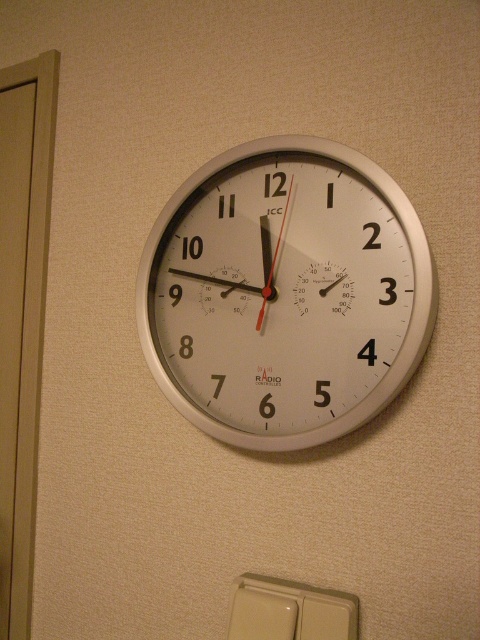
Question: Which object appears closest to the camera in this image?

Choices:
 (A) white metallic clock at center
 (B) beige plastic light switch at lower center

Answer: (A)

Question: Is white metallic clock at center smaller than beige plastic light switch at lower center?

Choices:
 (A) no
 (B) yes

Answer: (A)

Question: Can you confirm if white metallic clock at center is bigger than beige plastic light switch at lower center?

Choices:
 (A) no
 (B) yes

Answer: (B)

Question: Observing the image, what is the correct spatial positioning of white metallic clock at center in reference to beige plastic light switch at lower center?

Choices:
 (A) below
 (B) above

Answer: (B)